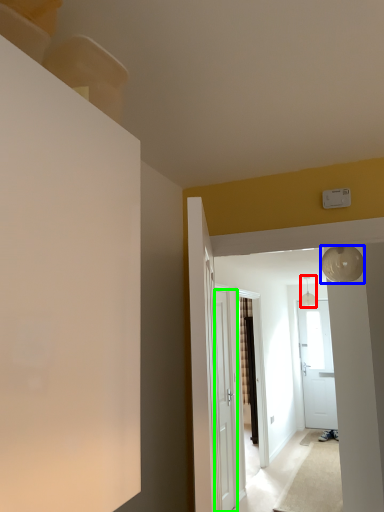
Question: Estimate the real-world distances between objects in this image. Which object is closer to light fixture (highlighted by a red box), lamp (highlighted by a blue box) or door (highlighted by a green box)?

Choices:
 (A) lamp
 (B) door

Answer: (B)